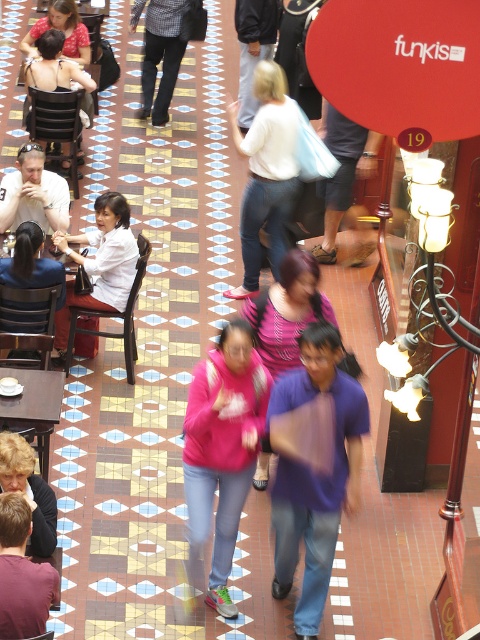
You are a customer at the mall and want to sit down. You see a brown leather jacket at lower left and a matte black chair at upper left. Which object is wider?

The matte black chair at upper left is wider than the brown leather jacket at lower left.

You are a photographer standing in the shopping mall scene. You want to take a photo of the white matte shirt at center and the matte black chair at upper left. Which object will appear closer to the camera in the photo?

The white matte shirt at center appears closer to the camera in the photo because it is positioned in front of the matte black chair at upper left.

You are standing in the shopping mall and see the brown leather jacket at lower left and the checkered fabric pants at upper center. Which of these two items is positioned lower in the image?

The brown leather jacket at lower left is positioned lower than the checkered fabric pants at upper center.